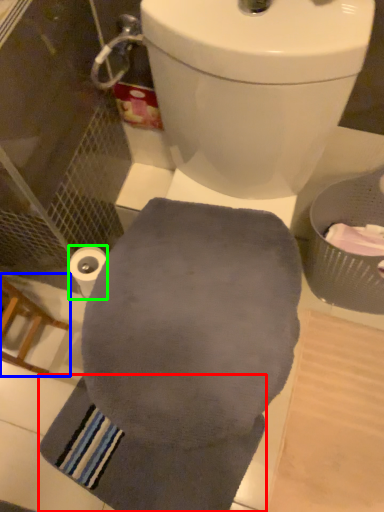
Question: Based on their relative distances, which object is farther from bath towel (highlighted by a red box)? Choose from chair (highlighted by a blue box) and toilet paper (highlighted by a green box).

Choices:
 (A) chair
 (B) toilet paper

Answer: (B)